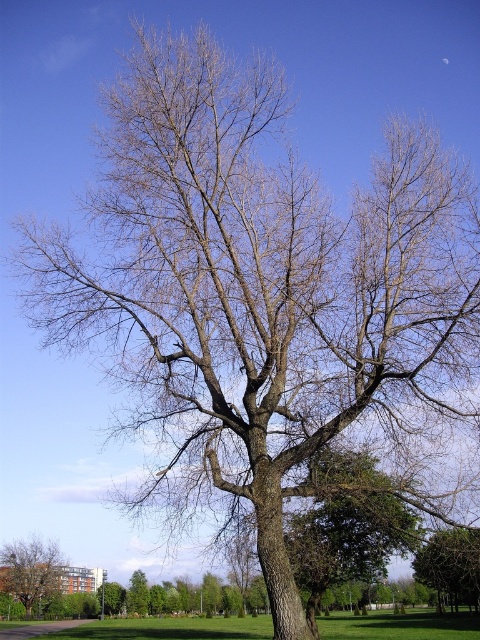
Question: Which of the following is the closest to the observer?

Choices:
 (A) green leafy tree at lower right
 (B) brown rough tree at lower left
 (C) brown rough tree at center

Answer: (A)

Question: Does green leafy tree at lower right appear under brown rough tree at center?

Choices:
 (A) yes
 (B) no

Answer: (B)

Question: Is green leafy tree at center smaller than brown rough tree at center?

Choices:
 (A) yes
 (B) no

Answer: (A)

Question: Which point is closer to the camera taking this photo?

Choices:
 (A) (140, 605)
 (B) (312, 506)

Answer: (B)

Question: Which object is closer to the camera taking this photo?

Choices:
 (A) green grass at center
 (B) brown rough tree at center

Answer: (A)

Question: Where is brown rough tree at lower left located in relation to brown rough tree at center in the image?

Choices:
 (A) left
 (B) right

Answer: (A)